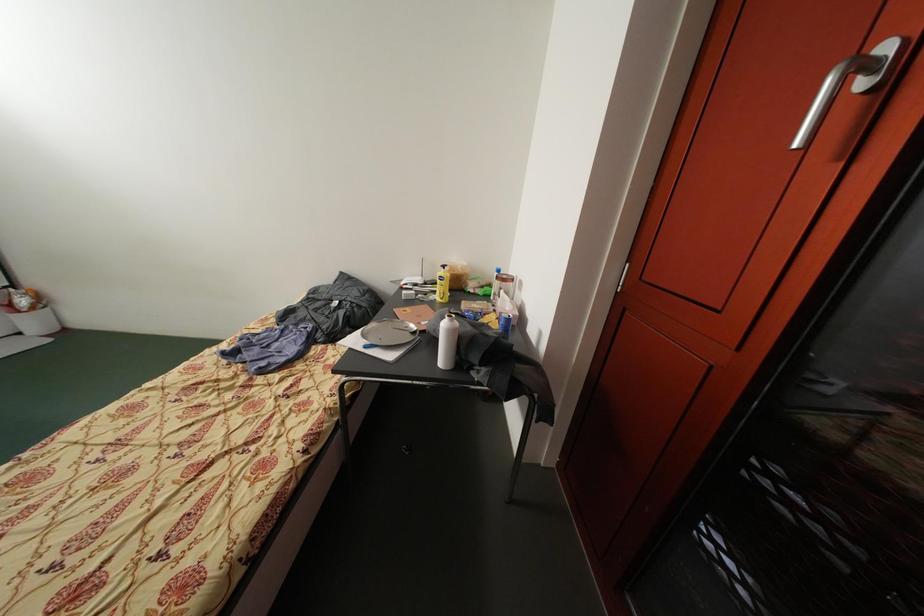
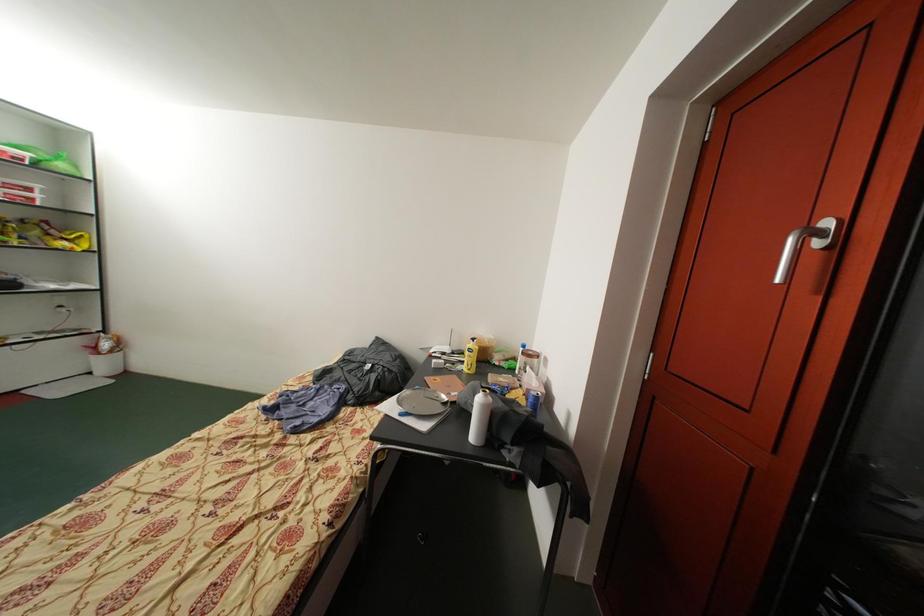
In a continuous first-person perspective shot, in which direction is the camera moving?

The cameraman moved toward left, backward.